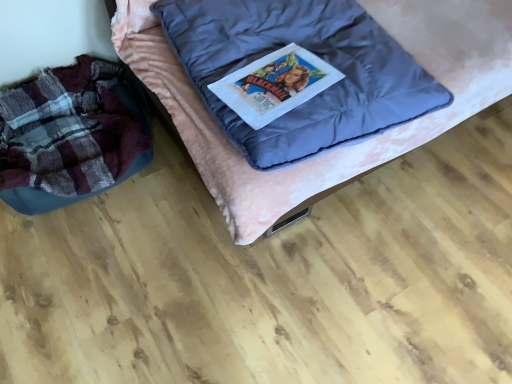
Question: From a real-world perspective, is plaid fabric bean bag at left above or below velvet pink bed at center?

Choices:
 (A) below
 (B) above

Answer: (A)

Question: From the image's perspective, is plaid fabric bean bag at left above or below velvet pink bed at center?

Choices:
 (A) below
 (B) above

Answer: (A)

Question: Is plaid fabric bean bag at left inside the boundaries of velvet pink bed at center, or outside?

Choices:
 (A) outside
 (B) inside

Answer: (A)

Question: Is velvet pink bed at center to the left or to the right of plaid fabric bean bag at left in the image?

Choices:
 (A) right
 (B) left

Answer: (A)

Question: Is velvet pink bed at center situated inside plaid fabric bean bag at left or outside?

Choices:
 (A) inside
 (B) outside

Answer: (B)

Question: Considering the positions of velvet pink bed at center and plaid fabric bean bag at left in the image, is velvet pink bed at center taller or shorter than plaid fabric bean bag at left?

Choices:
 (A) short
 (B) tall

Answer: (B)

Question: Considering the positions of velvet pink bed at center and plaid fabric bean bag at left in the image, is velvet pink bed at center bigger or smaller than plaid fabric bean bag at left?

Choices:
 (A) big
 (B) small

Answer: (A)